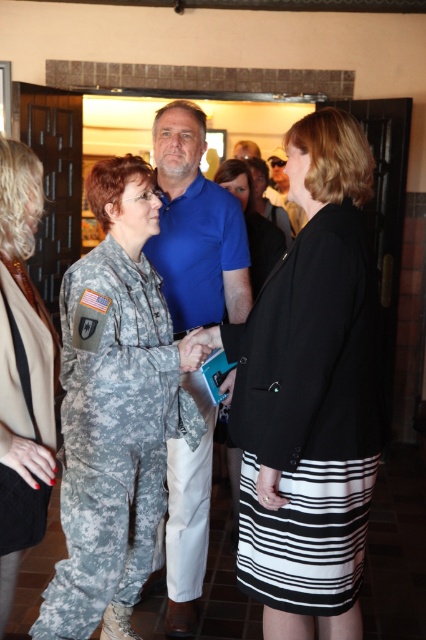
Question: Does camouflage fabric uniform at center have a lesser width compared to blue smooth shirt at center?

Choices:
 (A) yes
 (B) no

Answer: (B)

Question: Estimate the real-world distances between objects in this image. Which object is farther from the blue smooth shirt at center?

Choices:
 (A) black matte blazer at center
 (B) camouflage fabric skirt at center

Answer: (B)

Question: Which of the following is the closest to the observer?

Choices:
 (A) (40, 360)
 (B) (268, 246)
 (C) (363, 467)
 (D) (293, 586)

Answer: (A)

Question: Which point appears closest to the camera in this image?

Choices:
 (A) (101, 369)
 (B) (198, 497)
 (C) (307, 608)
 (D) (230, 166)

Answer: (C)

Question: Does camouflage fabric uniform at center have a lesser width compared to blue smooth shirt at center?

Choices:
 (A) no
 (B) yes

Answer: (A)

Question: Considering the relative positions of camouflage uniform at center and black fabric jacket at center in the image provided, where is camouflage uniform at center located with respect to black fabric jacket at center?

Choices:
 (A) left
 (B) right

Answer: (A)